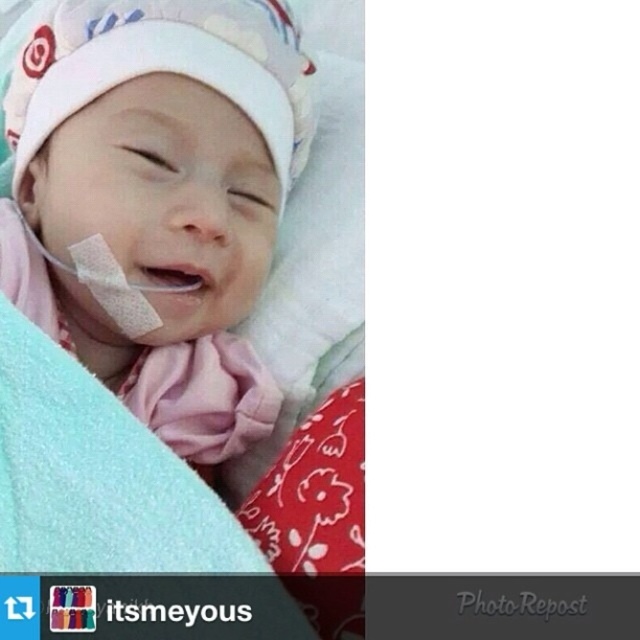
You are a nurse in the neonatal unit. You need to check the baby in the image. Which object is closer to the right side of the image, the white soft hat at upper center or the light blue soft blanket at center?

The white soft hat at upper center is to the right of the light blue soft blanket at center, so the white soft hat at upper center is closer to the right side of the image.

Based on the photo, you are a nurse in the neonatal unit. You need to check the size of the white soft hat at upper center and the white adhesive bandage at center on the baby. Which one has a larger size?

The white soft hat at upper center is bigger than the white adhesive bandage at center.